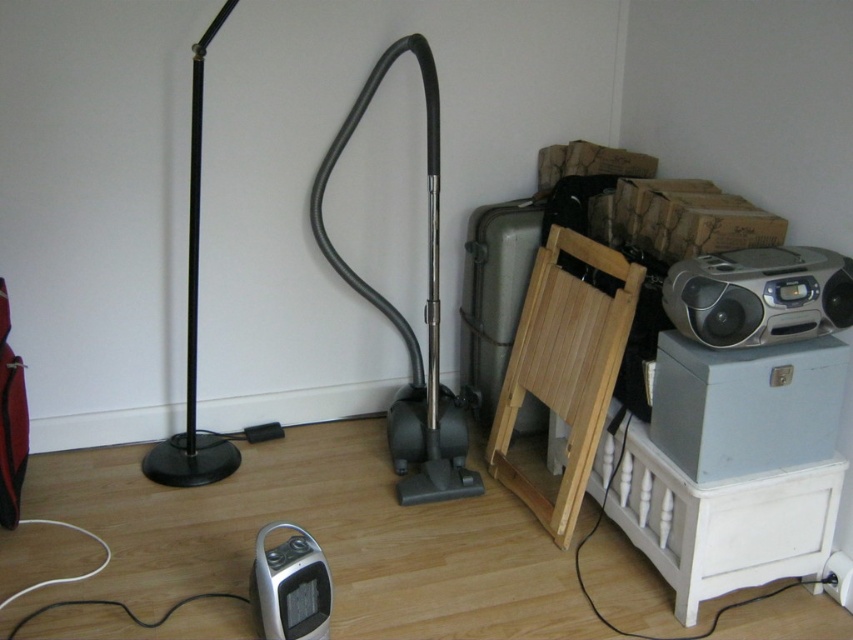
You are standing in the room and want to move from the point at coordinates point (701, 298) to point (196, 224). Which direction should you face to walk straight towards your destination?

Since point (701, 298) is in front of point (196, 224), you should face backward to walk straight towards point (196, 224).

You are trying to place a decorative item on a shelf that can only hold items wider than 30 cm. You have the silver metallic boombox at upper right and the black matte floor lamp at left. Which item should you choose?

The silver metallic boombox at upper right should be chosen because its width is larger than the black matte floor lamp at left, so it is more likely to exceed the 30 cm requirement.

You are organizing the items in the room. If you want to move the silver metallic boombox at upper right closer to the black matte floor lamp at left, which direction should you move it?

Answer: The silver metallic boombox at upper right is to the right of the black matte floor lamp at left, so you should move it to the left to bring it closer.